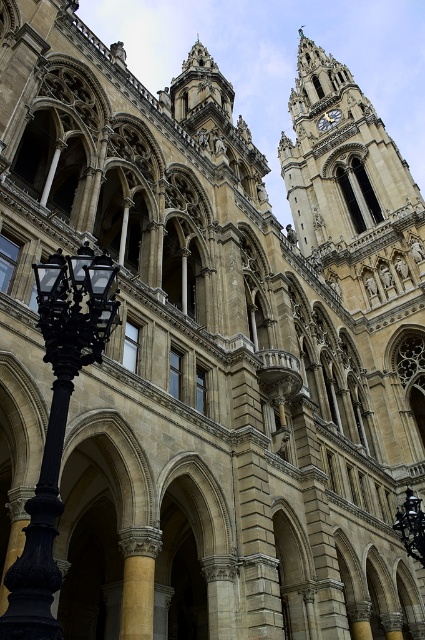
Consider the image. You are an architect designing a new lighting system for the building. The black wrought iron streetlight at left is positioned near the entrance. You need to ensure that the light from the streetlight does not cast a shadow over the gold metallic clock at upper center. Based on their relative widths, can you determine if the streetlight might block the clock from view?

The black wrought iron streetlight at left might be wider than the gold metallic clock at upper center. Since the streetlight is wider, it could potentially block the view of the clock if positioned directly in front of it.

You are a tourist standing in front of this historic building. You notice the stone clock tower at upper right and the black wrought iron streetlight at left. Which one appears taller from your vantage point?

The stone clock tower at upper right is taller than the black wrought iron streetlight at left, so it appears taller from your vantage point.

You are an architect analyzing the facade of this historic building. You notice the stone clock tower at upper right and the gold metallic clock at upper center. Which of these two objects has a greater width?

The stone clock tower at upper right has a greater width than the gold metallic clock at upper center, as stated in the description that its width surpasses the latter.